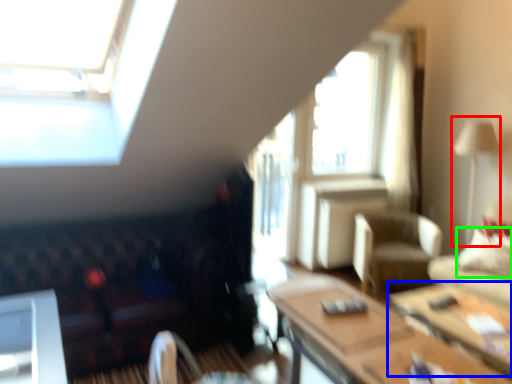
Question: Which is farther away from lamp (highlighted by a red box)? table (highlighted by a blue box) or pillow (highlighted by a green box)?

Choices:
 (A) table
 (B) pillow

Answer: (A)